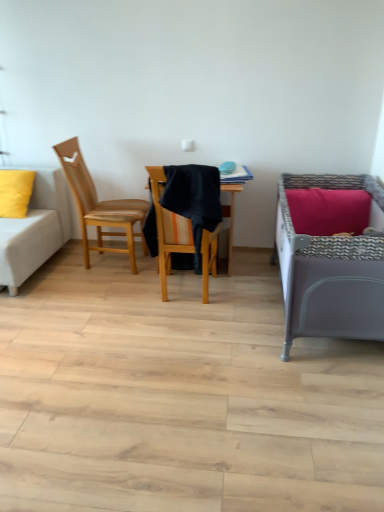
Locate an element on the screen. The image size is (384, 512). vacant space situated on the left part of wooden chair at center, which is the second chair from left to right is located at coordinates (121, 296).